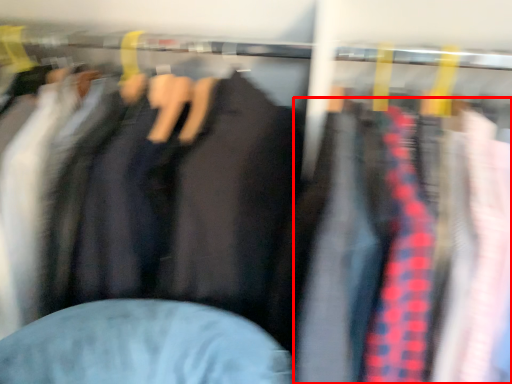
Question: From the image's perspective, where is clothing (annotated by the red box) located in relation to jacket in the image?

Choices:
 (A) above
 (B) below

Answer: (B)